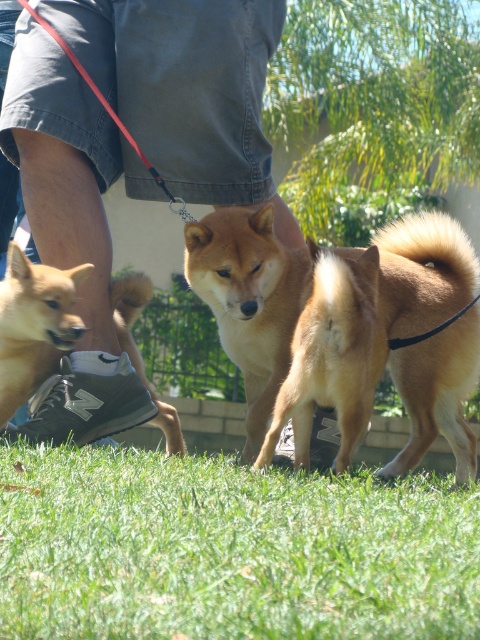
You are a photographer trying to capture a group photo of the golden fur dog at center and the gray denim shorts at lower left. If you want to ensure both subjects are in focus, what is the minimum distance you need to set your camera lens to?

The gray denim shorts at lower left is 31.66 inches from the golden fur dog at center. To ensure both are in focus, the camera lens should be set to a distance that covers this separation, so the minimum focus distance should be at least half of 31.66 inches, approximately 15.83 inches.

Consider the image. You are standing on the green grass at lower center and want to reach the golden fur dog at center. Is the area you are standing on smaller than the area where the golden fur dog is located?

The green grass at lower center occupies less space than the golden fur dog at center, so yes, the area you are standing on is smaller than where the golden fur dog is located.

You are standing in the scene and want to step onto the green grass at lower center. Which direction should you move relative to the gray denim shorts at lower left?

The green grass at lower center is to the right of the gray denim shorts at lower left, so you should move to the right of the gray denim shorts at lower left to step onto the green grass at lower center.